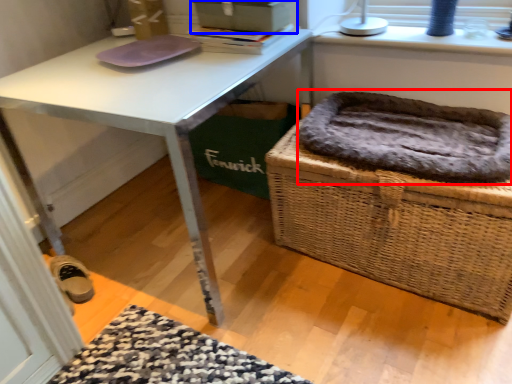
Question: Among these objects, which one is nearest to the camera, cat bed (highlighted by a red box) or box (highlighted by a blue box)?

Choices:
 (A) cat bed
 (B) box

Answer: (A)